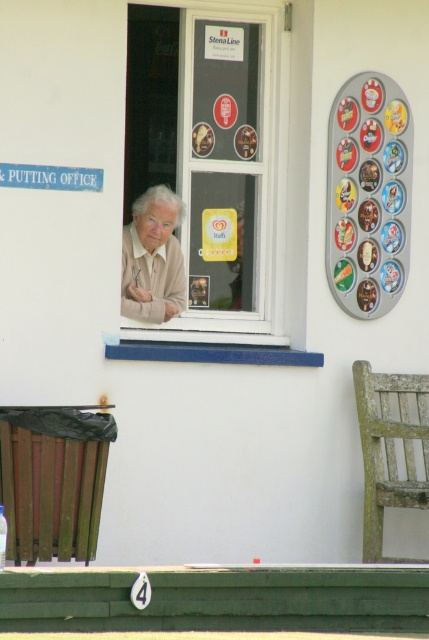
Question: Which point appears farthest from the camera in this image?

Choices:
 (A) (180, 282)
 (B) (256, 92)

Answer: (B)

Question: Does white plastic window at center lie behind light beige sweater at center?

Choices:
 (A) yes
 (B) no

Answer: (A)

Question: Which of the following is the farthest from the observer?

Choices:
 (A) (184, 138)
 (B) (154, 209)

Answer: (A)

Question: Among these objects, which one is farthest from the camera?

Choices:
 (A) light beige sweater at center
 (B) white plastic window at center

Answer: (B)

Question: Does white plastic window at center appear under light beige sweater at center?

Choices:
 (A) yes
 (B) no

Answer: (B)

Question: Is white plastic window at center positioned behind light beige sweater at center?

Choices:
 (A) no
 (B) yes

Answer: (B)